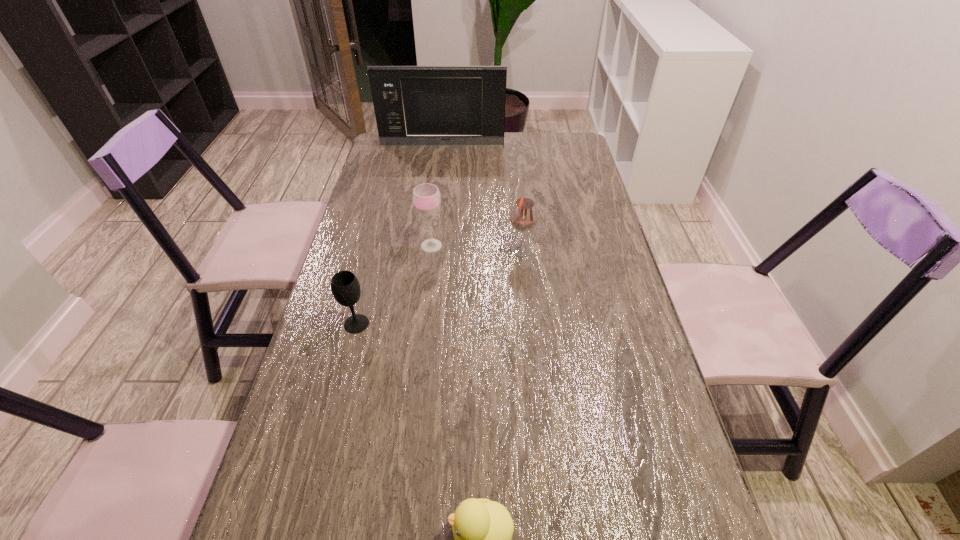
In order to click on the farthest object in this screenshot , I will do `click(414, 105)`.

At what (x,y) coordinates should I click in order to perform the action: click on the tallest object. Please return your answer as a coordinate pair (x, y). Looking at the image, I should click on (414, 105).

This screenshot has width=960, height=540. In order to click on the second wineglass from right to left in this screenshot , I will do `click(426, 197)`.

This screenshot has width=960, height=540. In order to click on the rightmost wineglass in this screenshot , I will do `click(523, 217)`.

The image size is (960, 540). What are the coordinates of `the fourth farthest object` in the screenshot? It's located at (345, 286).

Locate an element on the screen. the leftmost wineglass is located at coordinates (345, 286).

This screenshot has width=960, height=540. I want to click on free location located 0.050m on the front panel of the tallest object, so click(442, 153).

Where is `vacant space located 0.220m on the right of the second wineglass from left to right`? The width and height of the screenshot is (960, 540). vacant space located 0.220m on the right of the second wineglass from left to right is located at coordinates (519, 246).

Image resolution: width=960 pixels, height=540 pixels. In order to click on vacant space situated on the front of the rightmost wineglass in this screenshot , I will do `click(530, 345)`.

Locate an element on the screen. The height and width of the screenshot is (540, 960). vacant space located 0.100m on the front of the leftmost wineglass is located at coordinates (346, 369).